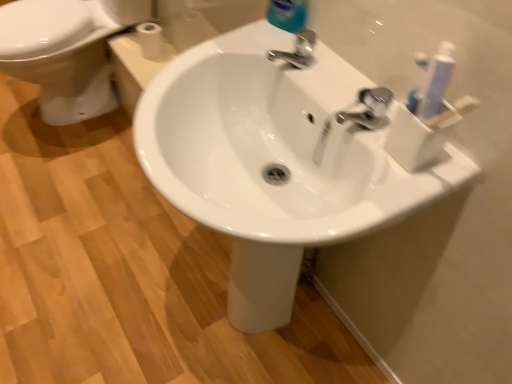
Question: Considering the relative positions of white matte toilet paper at upper left and white glossy bidet at left in the image provided, is white matte toilet paper at upper left in front of white glossy bidet at left?

Choices:
 (A) no
 (B) yes

Answer: (A)

Question: From a real-world perspective, is white matte toilet paper at upper left positioned over white glossy bidet at left based on gravity?

Choices:
 (A) no
 (B) yes

Answer: (B)

Question: Is white matte toilet paper at upper left facing away from white glossy bidet at left?

Choices:
 (A) no
 (B) yes

Answer: (A)

Question: Considering the relative positions of white matte toilet paper at upper left and white glossy bidet at left in the image provided, is white matte toilet paper at upper left to the right of white glossy bidet at left from the viewer's perspective?

Choices:
 (A) no
 (B) yes

Answer: (B)

Question: Can you confirm if white matte toilet paper at upper left is bigger than white glossy bidet at left?

Choices:
 (A) no
 (B) yes

Answer: (A)

Question: Are white matte toilet paper at upper left and white glossy bidet at left making contact?

Choices:
 (A) yes
 (B) no

Answer: (B)

Question: Can you confirm if white glossy sink at center is shorter than polished chrome faucet at upper right, the 2th tap viewed from the back?

Choices:
 (A) no
 (B) yes

Answer: (A)

Question: Is white glossy sink at center turned away from polished chrome faucet at upper right, which appears as the second tap when viewed from the top?

Choices:
 (A) yes
 (B) no

Answer: (B)

Question: Is white glossy sink at center positioned far away from polished chrome faucet at upper right, acting as the 1th tap starting from the front?

Choices:
 (A) yes
 (B) no

Answer: (B)

Question: Is white glossy sink at center to the left of polished chrome faucet at upper right, acting as the 1th tap starting from the front, from the viewer's perspective?

Choices:
 (A) no
 (B) yes

Answer: (B)

Question: Can you confirm if white glossy sink at center is thinner than polished chrome faucet at upper right, the 2th tap viewed from the back?

Choices:
 (A) yes
 (B) no

Answer: (B)

Question: From the image's perspective, is white glossy sink at center beneath polished chrome faucet at upper right, acting as the 1th tap starting from the front?

Choices:
 (A) yes
 (B) no

Answer: (A)

Question: Is blue glossy bottle at upper center bigger than white glossy sink at center?

Choices:
 (A) yes
 (B) no

Answer: (B)